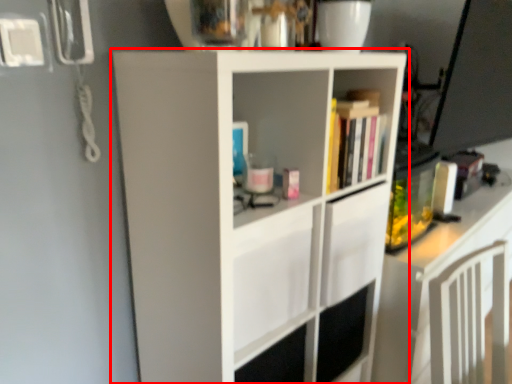
Question: From the image, what is the correct spatial relationship of cupboard (annotated by the red box) in relation to shelf?

Choices:
 (A) right
 (B) left

Answer: (B)